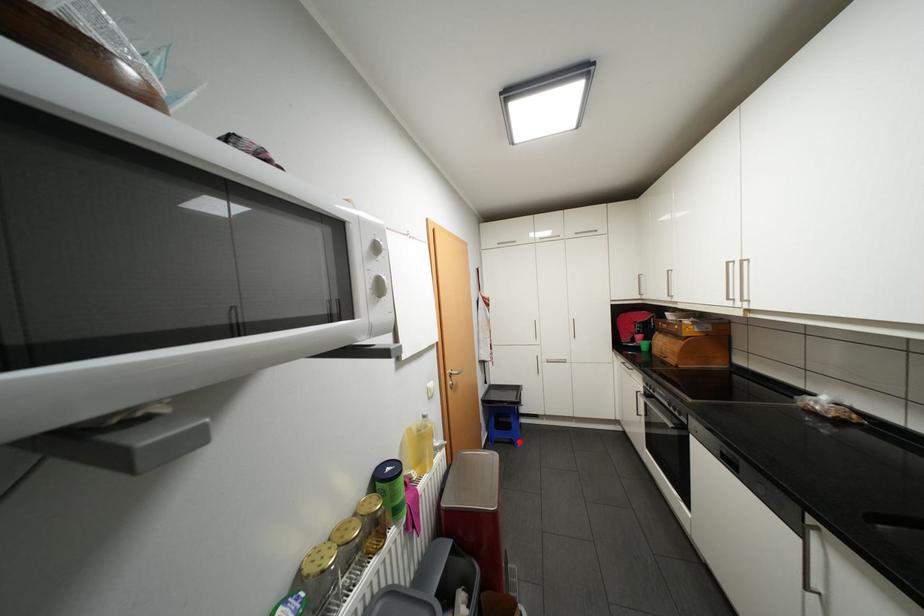
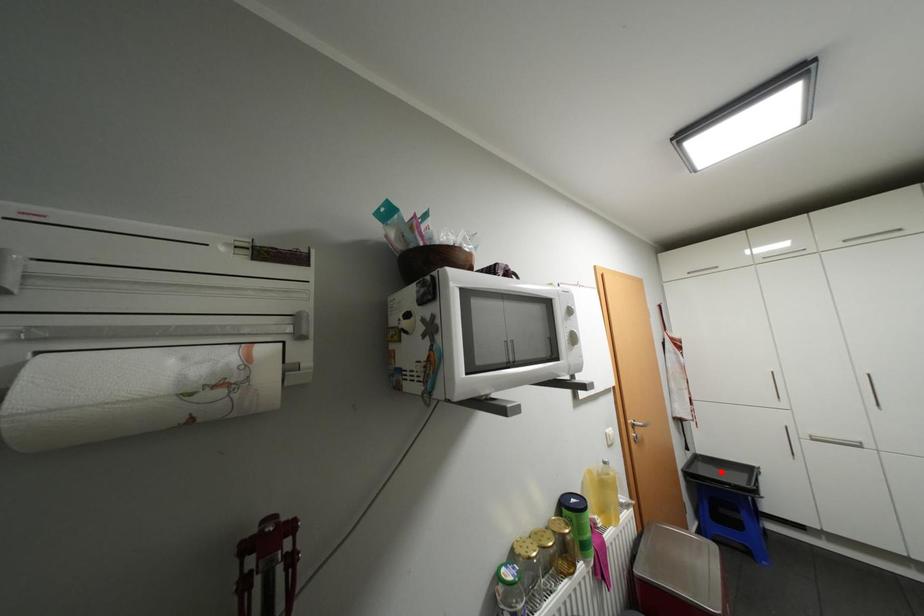
I am providing you with two images of the same scene from different viewpoints. A red point is marked on the first image and another point is marked on the second image. Do the highlighted points in image1 and image2 indicate the same real-world spot?

No